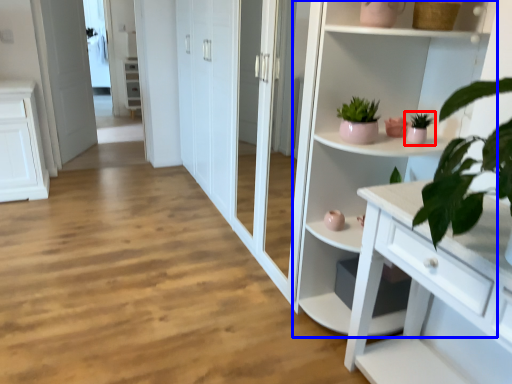
Question: Among these objects, which one is farthest to the camera, houseplant (highlighted by a red box) or cupboard (highlighted by a blue box)?

Choices:
 (A) houseplant
 (B) cupboard

Answer: (A)